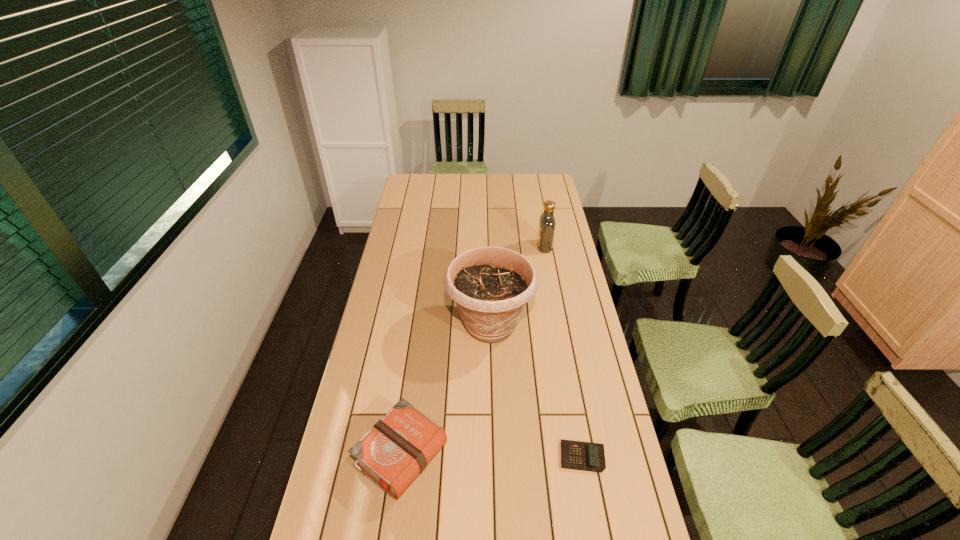
The height and width of the screenshot is (540, 960). Identify the location of vacant point that satisfies the following two spatial constraints: 1. on the front side of the calculator; 2. on the right side of the third nearest object. click(x=492, y=457).